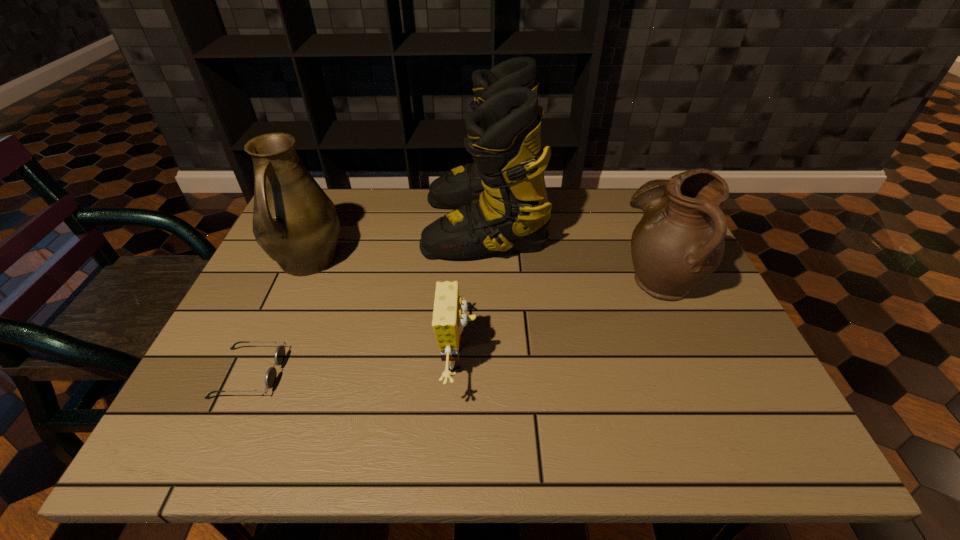
What are the coordinates of `free space at the far left corner of the desktop` in the screenshot? It's located at (341, 190).

In the image, there is a desktop. What are the coordinates of `free space at the far right corner` in the screenshot? It's located at (631, 224).

Find the location of `free space at the near right corner of the desktop`. free space at the near right corner of the desktop is located at coordinates (735, 433).

The height and width of the screenshot is (540, 960). What are the coordinates of `free space that is in between the tallest object and the sponge` in the screenshot? It's located at (471, 292).

The image size is (960, 540). In order to click on empty location between the shortest object and the ski boots in this screenshot , I will do `click(367, 299)`.

Locate an element on the screen. empty space that is in between the left pitcher and the sunglasses is located at coordinates (278, 317).

Where is `free spot between the second shortest object and the left pitcher`? The width and height of the screenshot is (960, 540). free spot between the second shortest object and the left pitcher is located at coordinates (383, 311).

Identify the location of empty location between the fourth tallest object and the ski boots. (471, 292).

At what (x,y) coordinates should I click in order to perform the action: click on vacant point located between the sponge and the sunglasses. Please return your answer as a coordinate pair (x, y). Looking at the image, I should click on (354, 367).

Locate an element on the screen. Image resolution: width=960 pixels, height=540 pixels. free space that is in between the sponge and the right pitcher is located at coordinates (559, 319).